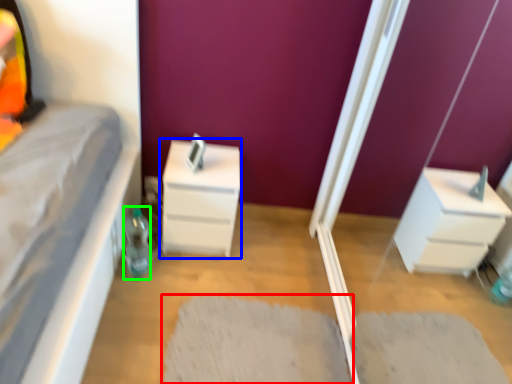
Question: Which object is positioned farthest from doormat (highlighted by a red box)? Select from chest of drawers (highlighted by a blue box) and bottle (highlighted by a green box).

Choices:
 (A) chest of drawers
 (B) bottle

Answer: (B)